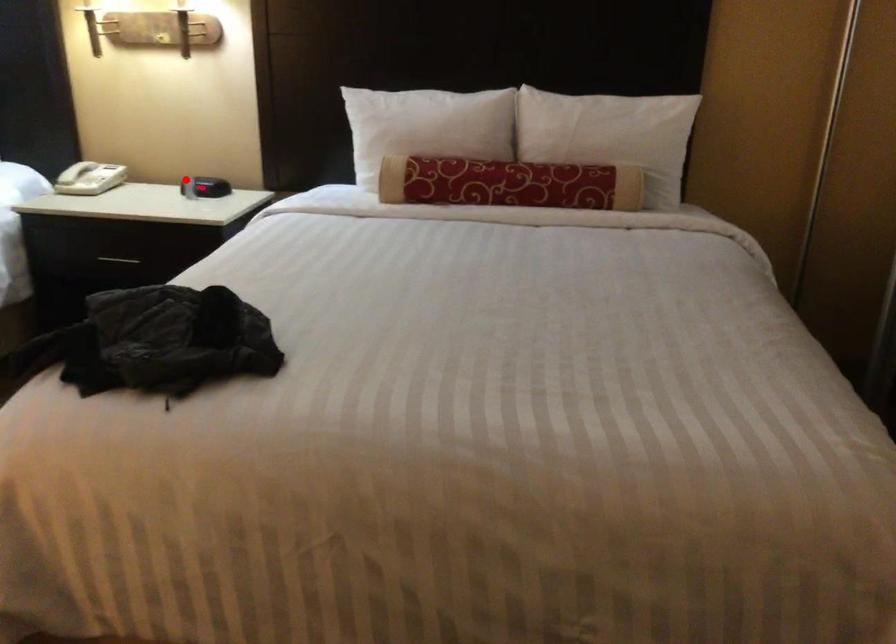
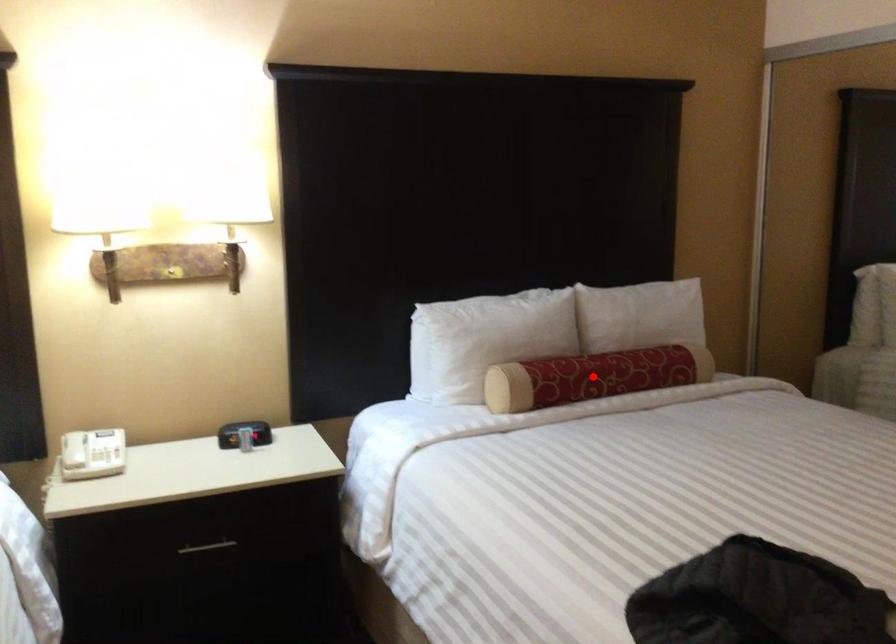
I am providing you with two images of the same scene from different viewpoints. A red point is marked on the first image and another point is marked on the second image. Is the red point in image1 aligned with the point shown in image2?

No